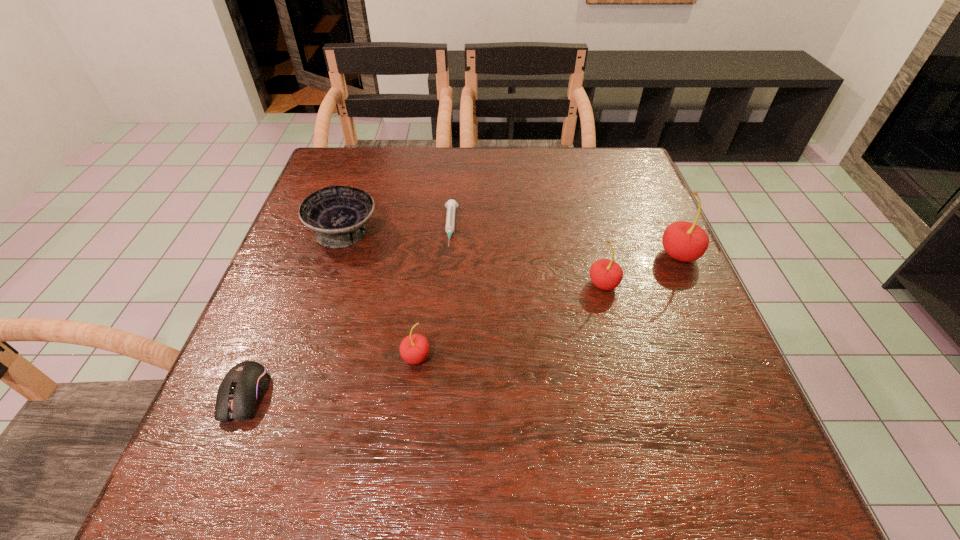
Locate an element on the screen. Image resolution: width=960 pixels, height=540 pixels. vacant point at the far edge is located at coordinates (537, 183).

Where is `vacant region at the near edge of the desktop`? vacant region at the near edge of the desktop is located at coordinates (468, 396).

The width and height of the screenshot is (960, 540). In the image, there is a desktop. Find the location of `free region at the left edge`. free region at the left edge is located at coordinates (341, 285).

Locate an element on the screen. Image resolution: width=960 pixels, height=540 pixels. vacant space at the right edge of the desktop is located at coordinates (639, 218).

Identify the location of vacant space at the far left corner. (377, 167).

The height and width of the screenshot is (540, 960). In order to click on blank space at the far right corner in this screenshot , I will do `click(595, 166)`.

Where is `vacant area at the near right corner of the desktop`? This screenshot has height=540, width=960. vacant area at the near right corner of the desktop is located at coordinates (667, 394).

Identify the location of free spot between the fourth tallest object and the fourth object from left to right. (397, 230).

Find the location of `free space between the fifth shortest object and the fourth object from right to left`. free space between the fifth shortest object and the fourth object from right to left is located at coordinates (510, 320).

Where is `vacant space that is in between the second farthest cherry and the syringe`? The width and height of the screenshot is (960, 540). vacant space that is in between the second farthest cherry and the syringe is located at coordinates (527, 256).